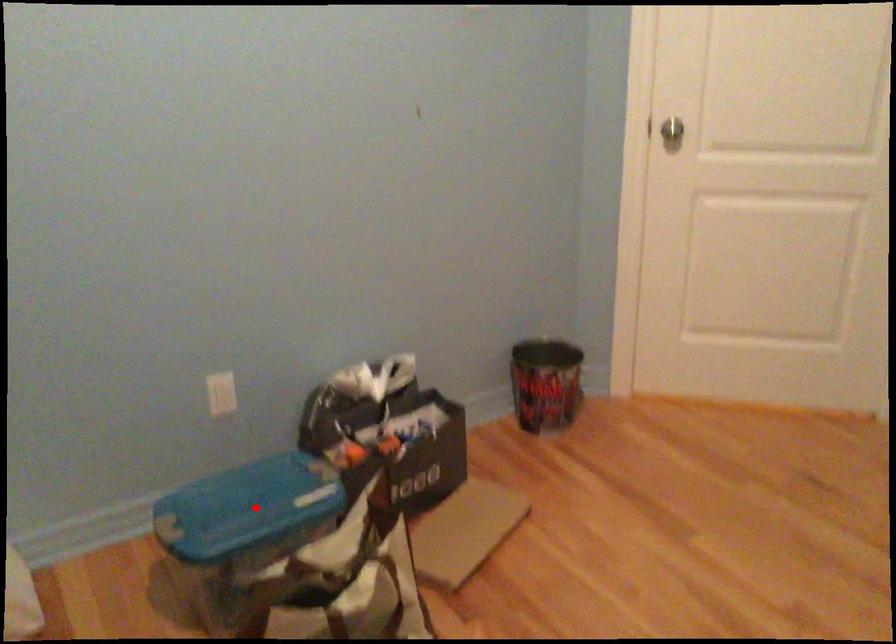
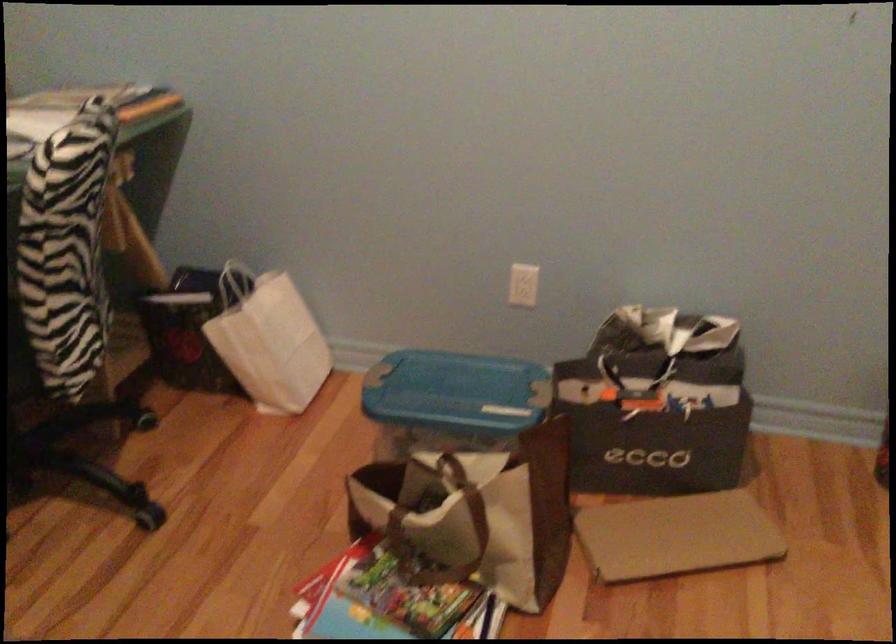
Question: I am providing you with two images of the same scene from different viewpoints. A red point is marked on the first image. Can you still see the location of the red point in image 2?

Choices:
 (A) Yes
 (B) No

Answer: (A)